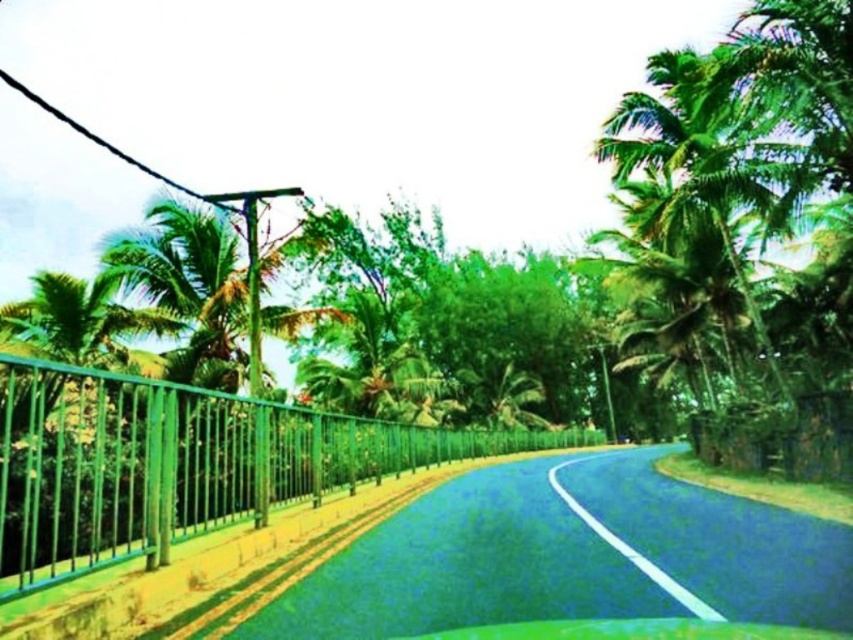
Question: Does green metal fence at left appear over green leafy palm tree at upper right?

Choices:
 (A) yes
 (B) no

Answer: (B)

Question: Can you confirm if green metal fence at left is thinner than green leafy palm tree at upper right?

Choices:
 (A) yes
 (B) no

Answer: (B)

Question: Does green metal fence at left have a greater width compared to green leafy palm tree at upper right?

Choices:
 (A) yes
 (B) no

Answer: (A)

Question: Which point appears farthest from the camera in this image?

Choices:
 (A) (711, 140)
 (B) (268, 429)

Answer: (A)

Question: Which of the following is the closest to the observer?

Choices:
 (A) (281, 433)
 (B) (665, 104)

Answer: (A)